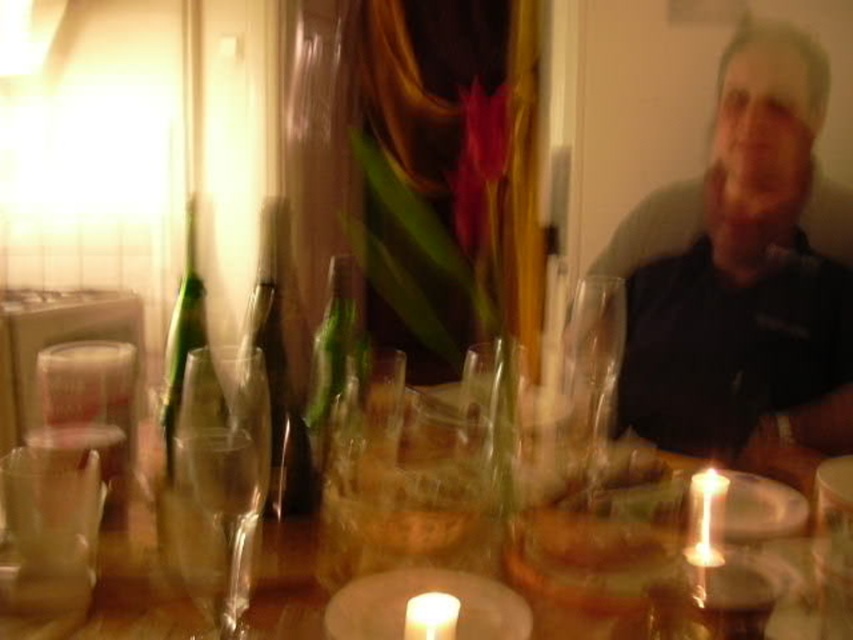
You are at a table in a dimly lit room with a clear glass wine glass at center and a white wax candle at center. Which object is positioned to the right of the other?

The clear glass wine glass at center is to the right of the white wax candle at center.

You are standing at the edge of the table in the dimly lit dining area. There are two points marked on the table surface. Which point is closer to you, point (589, 461) or point (431, 625)?

Point (589, 461) is closer to you because it is further to the viewer than point (431, 625).

You are a guest at a dinner party and want to light the white wax candle at center. However, there is a transparent glass wine glass at left in the way. Can you light the candle without moving the glass?

The white wax candle at center is behind the transparent glass wine glass at left, so you can light the candle without moving the glass because it is positioned behind the glass.